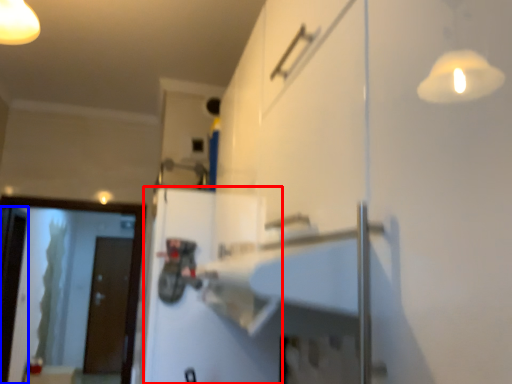
Question: Which object appears farthest to the camera in this image, door (highlighted by a red box) or screen door (highlighted by a blue box)?

Choices:
 (A) door
 (B) screen door

Answer: (B)